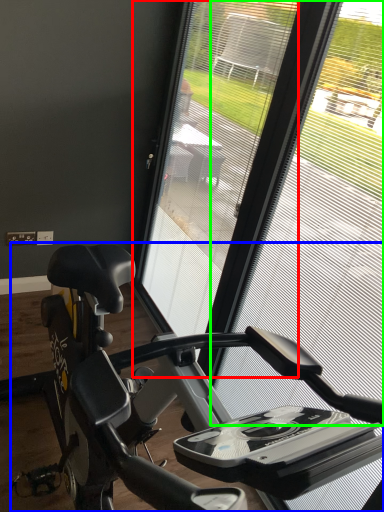
Question: Which object is the closest to the screen door (highlighted by a red box)? Choose among these: stationary bicycle (highlighted by a blue box) or window screen (highlighted by a green box).

Choices:
 (A) stationary bicycle
 (B) window screen

Answer: (A)